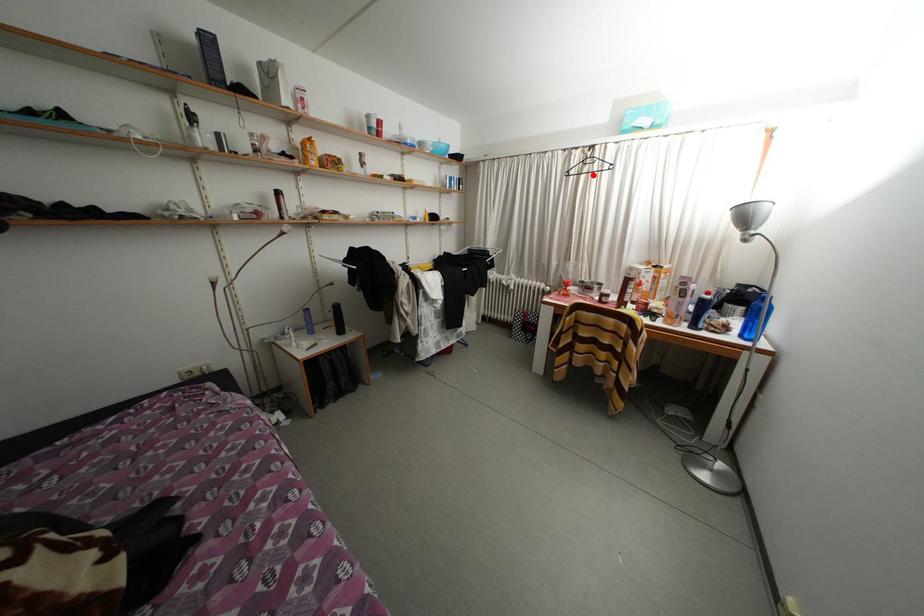
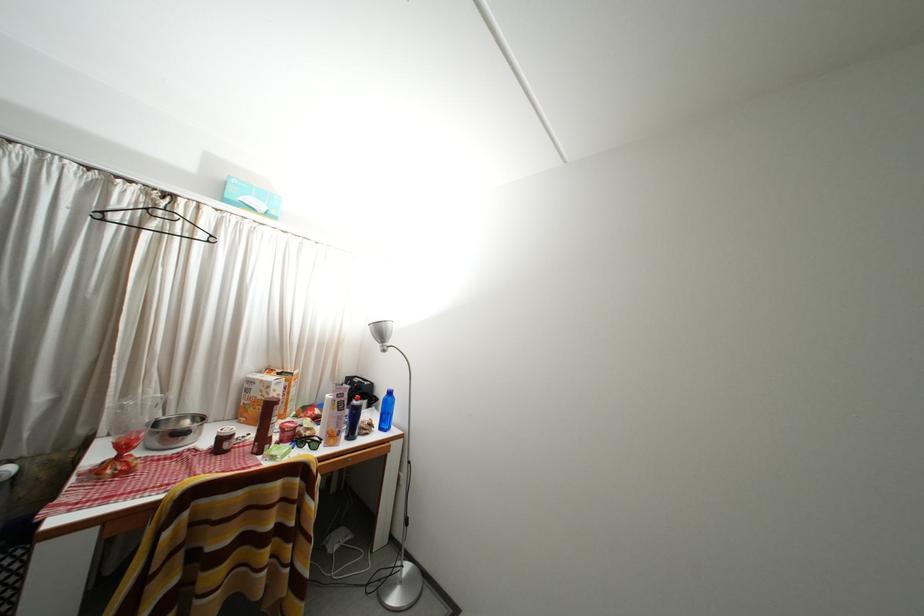
Find the pixel in the second image that matches the highlighted location in the first image.

(161, 230)